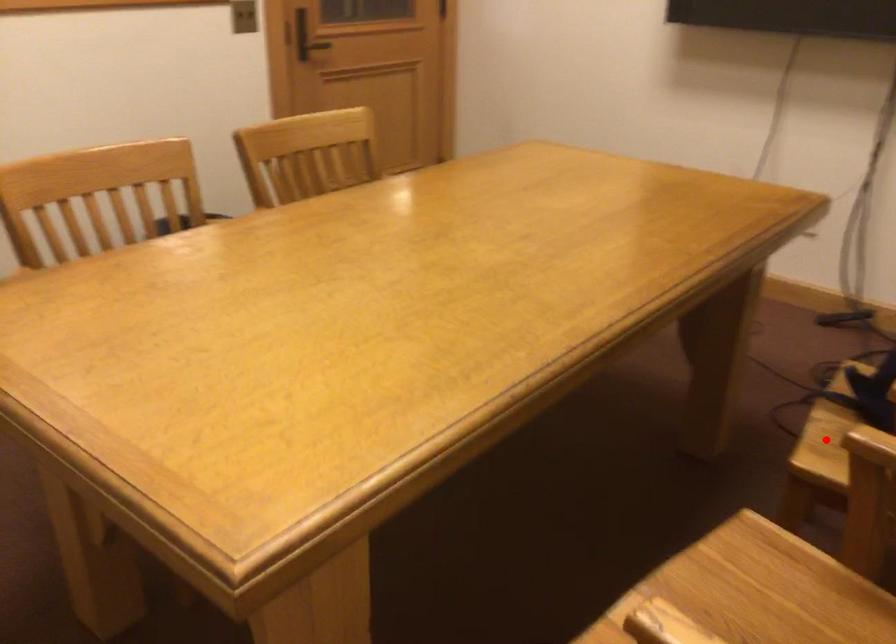
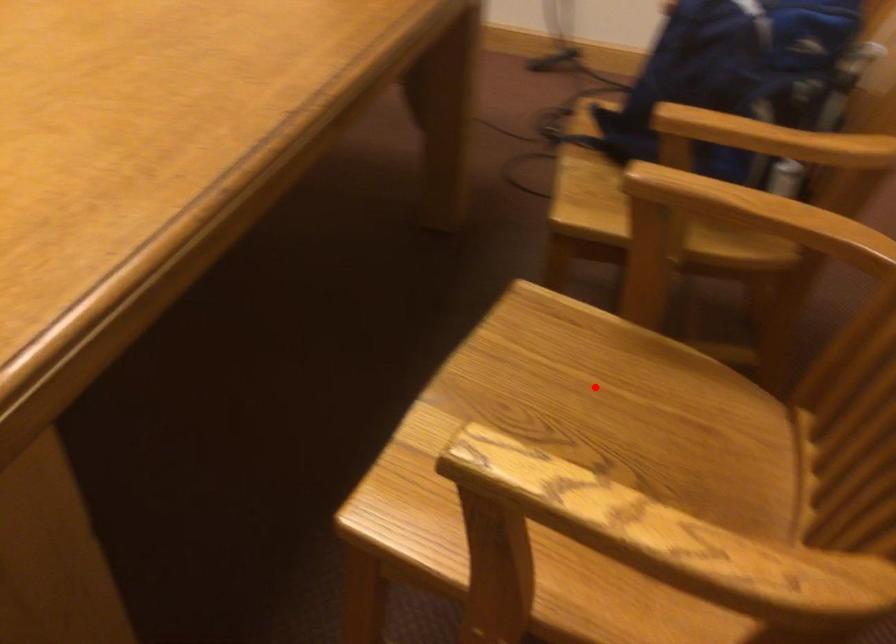
I am providing you with two images of the same scene from different viewpoints. A red point is marked on the first image and another point is marked on the second image. Is the marked point in image1 the same physical position as the marked point in image2?

No